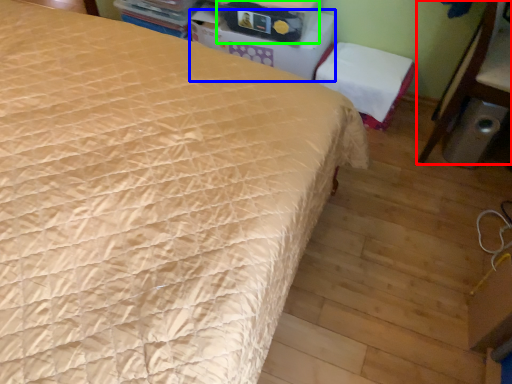
Question: Which is farther away from furniture (highlighted by a red box)? table (highlighted by a blue box) or storage box (highlighted by a green box)?

Choices:
 (A) table
 (B) storage box

Answer: (B)